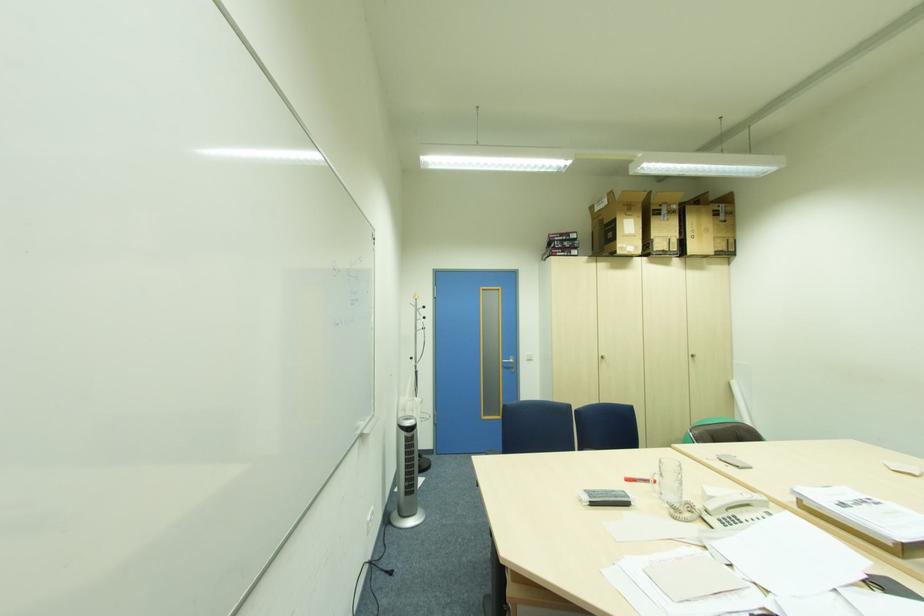
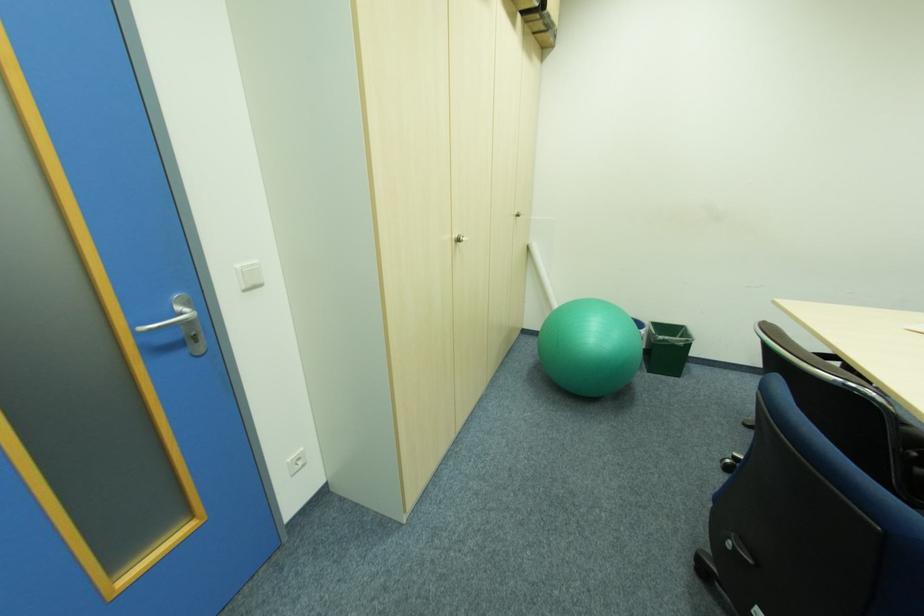
Find the pixel in the second image that matches [517,368] in the first image.

(200, 339)